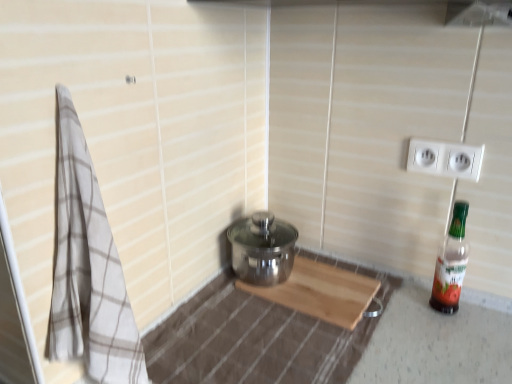
Question: Is beige checkered towel at left positioned with its back to white plastic electric outlet at upper right?

Choices:
 (A) yes
 (B) no

Answer: (B)

Question: Can you confirm if beige checkered towel at left is smaller than white plastic electric outlet at upper right?

Choices:
 (A) yes
 (B) no

Answer: (B)

Question: From the image's perspective, is beige checkered towel at left over white plastic electric outlet at upper right?

Choices:
 (A) no
 (B) yes

Answer: (A)

Question: Does beige checkered towel at left touch white plastic electric outlet at upper right?

Choices:
 (A) yes
 (B) no

Answer: (B)

Question: Considering the relative sizes of beige checkered towel at left and white plastic electric outlet at upper right in the image provided, is beige checkered towel at left bigger than white plastic electric outlet at upper right?

Choices:
 (A) no
 (B) yes

Answer: (B)

Question: Is translucent plastic bottle at right bigger or smaller than beige checkered towel at left?

Choices:
 (A) small
 (B) big

Answer: (A)

Question: Visually, is translucent plastic bottle at right positioned to the left or to the right of beige checkered towel at left?

Choices:
 (A) right
 (B) left

Answer: (A)

Question: Considering the positions of point (446, 289) and point (79, 345), is point (446, 289) closer or farther from the camera than point (79, 345)?

Choices:
 (A) farther
 (B) closer

Answer: (A)

Question: Is translucent plastic bottle at right taller or shorter than beige checkered towel at left?

Choices:
 (A) tall
 (B) short

Answer: (B)

Question: Choose the correct answer: Is beige checkered towel at left inside translucent plastic bottle at right or outside it?

Choices:
 (A) inside
 (B) outside

Answer: (B)

Question: Considering the positions of beige checkered towel at left and translucent plastic bottle at right in the image, is beige checkered towel at left taller or shorter than translucent plastic bottle at right?

Choices:
 (A) short
 (B) tall

Answer: (B)

Question: From the image's perspective, relative to translucent plastic bottle at right, is beige checkered towel at left above or below?

Choices:
 (A) above
 (B) below

Answer: (A)

Question: Looking at the image, does beige checkered towel at left seem bigger or smaller compared to translucent plastic bottle at right?

Choices:
 (A) small
 (B) big

Answer: (B)

Question: From a real-world perspective, is beige checkered towel at left physically located above or below white plastic electric outlet at upper right?

Choices:
 (A) below
 (B) above

Answer: (A)

Question: Which is correct: beige checkered towel at left is inside white plastic electric outlet at upper right, or outside of it?

Choices:
 (A) outside
 (B) inside

Answer: (A)